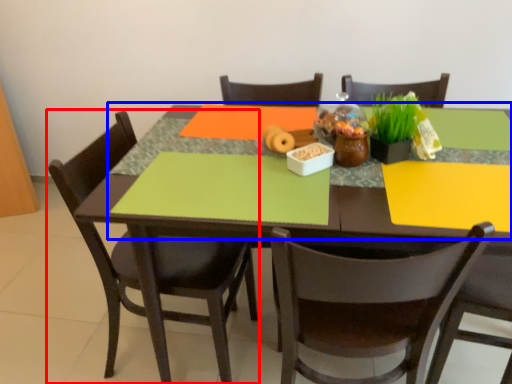
Question: Which object is closer to the camera taking this photo, chair (highlighted by a red box) or tablecloth (highlighted by a blue box)?

Choices:
 (A) chair
 (B) tablecloth

Answer: (B)